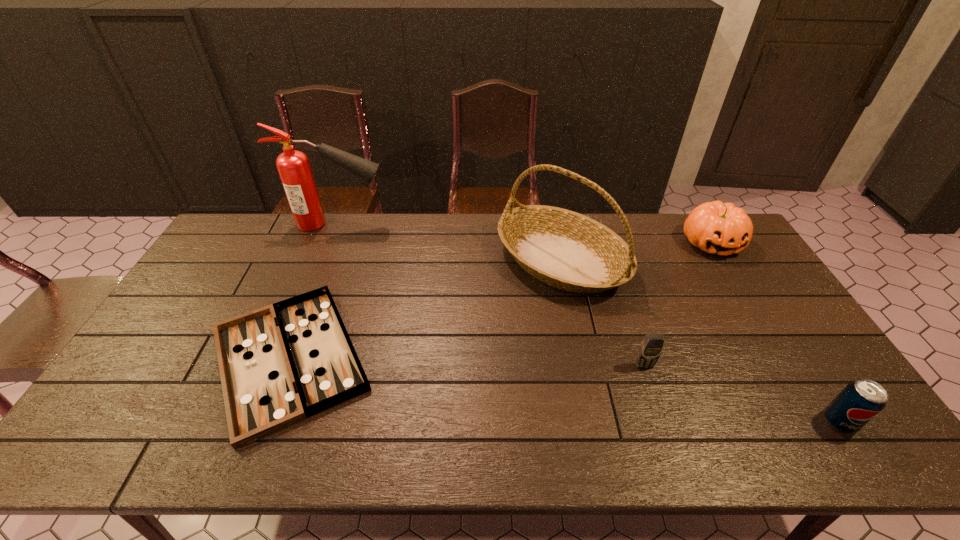
Find the location of a particular element. This screenshot has height=540, width=960. vacant area in the image that satisfies the following two spatial constraints: 1. on the back side of the basket; 2. at the nozzle of the fire extinguisher is located at coordinates (554, 224).

Where is `vacant space that satisfies the following two spatial constraints: 1. at the nozzle of the gameboard; 2. on the left side of the fire extinguisher`? The width and height of the screenshot is (960, 540). vacant space that satisfies the following two spatial constraints: 1. at the nozzle of the gameboard; 2. on the left side of the fire extinguisher is located at coordinates (284, 358).

This screenshot has height=540, width=960. I want to click on free spot that satisfies the following two spatial constraints: 1. on the front face of the cellular telephone; 2. on the left side of the soda can, so click(662, 422).